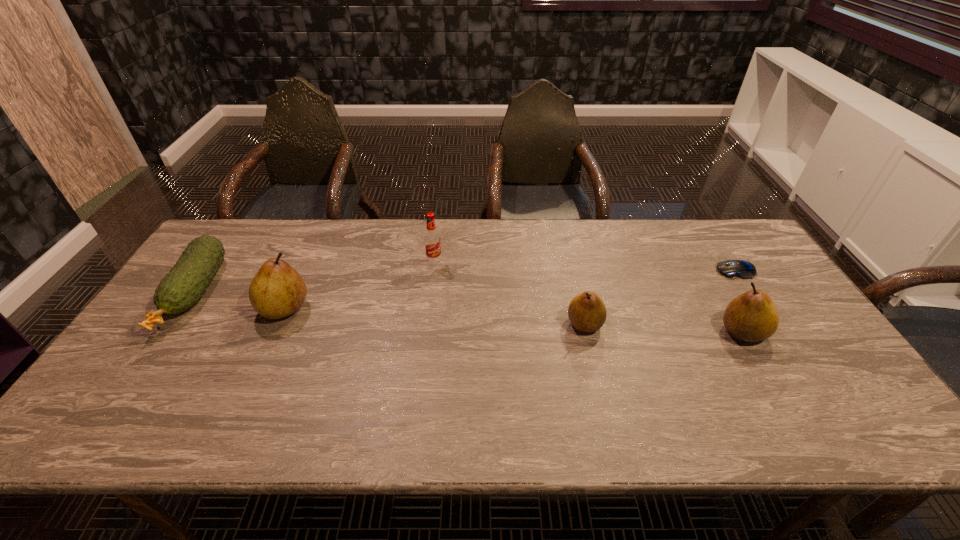
Identify the location of object that is the fourth closest to the shortest object. The image size is (960, 540). 277,290.

Locate which pear ranks second in proximity to the shortest object. Please provide its 2D coordinates. Your answer should be formatted as a tuple, i.e. [(x, y)], where the tuple contains the x and y coordinates of a point satisfying the conditions above.

[(587, 312)]

This screenshot has height=540, width=960. Identify the location of pear that stands as the closest to the fourth object from left to right. (752, 316).

Image resolution: width=960 pixels, height=540 pixels. Identify the location of free space that satisfies the following two spatial constraints: 1. at the blossom end of the second pear from left to right; 2. on the right side of the cucumber. (173, 323).

Locate an element on the screen. This screenshot has width=960, height=540. vacant point that satisfies the following two spatial constraints: 1. on the button side of the computer mouse; 2. on the front side of the leftmost pear is located at coordinates (760, 308).